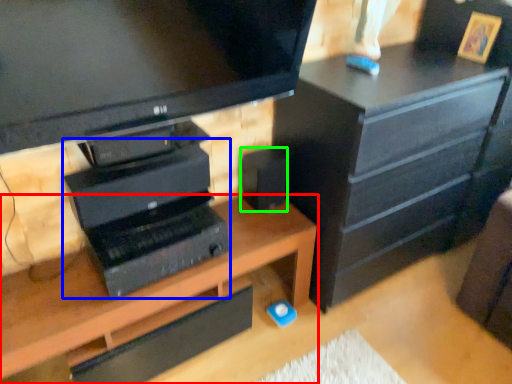
Question: Which object is positioned farthest from desk (highlighted by a red box)? Select from computer (highlighted by a blue box) and speaker (highlighted by a green box).

Choices:
 (A) computer
 (B) speaker

Answer: (B)